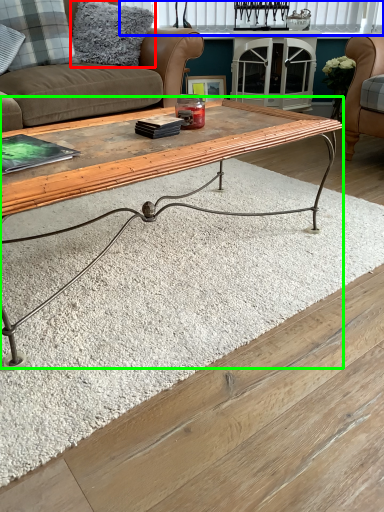
Question: Based on their relative distances, which object is nearer to pillow (highlighted by a red box)? Choose from window (highlighted by a blue box) and coffee table (highlighted by a green box).

Choices:
 (A) window
 (B) coffee table

Answer: (B)